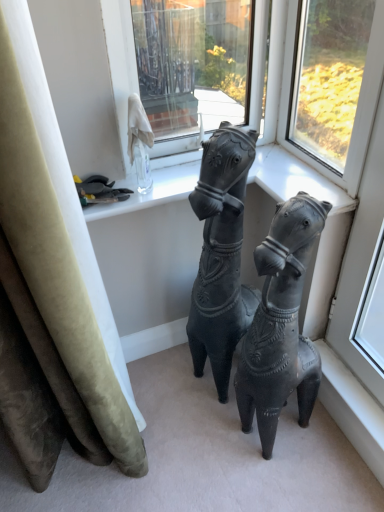
Question: Based on their positions, is transparent glass window at upper center, which is the first window in left-to-right order, located to the left or right of transparent glass window at upper center, marked as the second window in a left-to-right arrangement?

Choices:
 (A) left
 (B) right

Answer: (A)

Question: Is point (152, 111) positioned closer to the camera than point (382, 41)?

Choices:
 (A) farther
 (B) closer

Answer: (A)

Question: Which object is the farthest from the transparent glass window at upper center, the first window positioned from the right?

Choices:
 (A) matte black horse at center
 (B) transparent glass window at upper center, marked as the second window in a right-to-left arrangement

Answer: (B)

Question: Considering the real-world distances, which object is closest to the transparent glass window at upper center, marked as the second window in a left-to-right arrangement?

Choices:
 (A) transparent glass window at upper center, which is the first window in left-to-right order
 (B) matte black horse at center

Answer: (B)